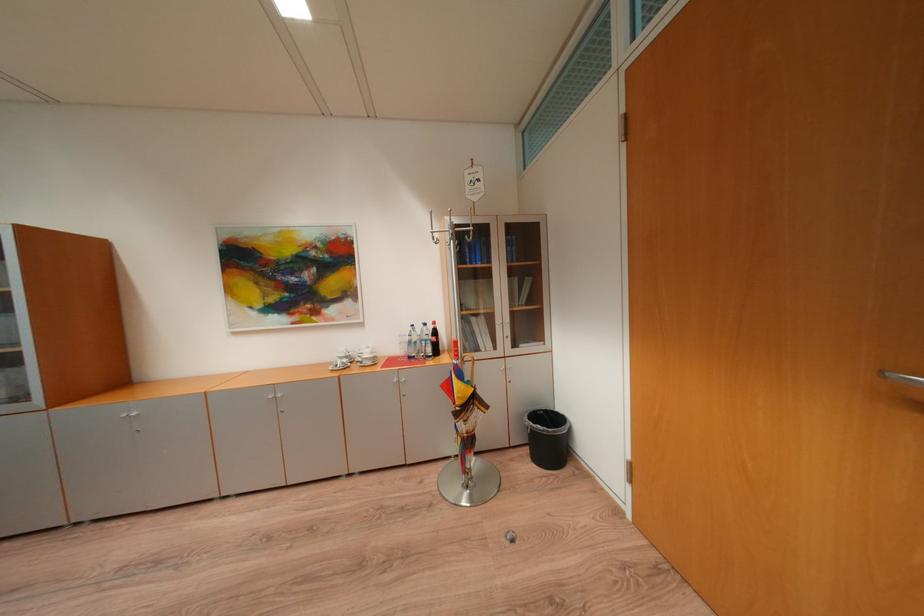
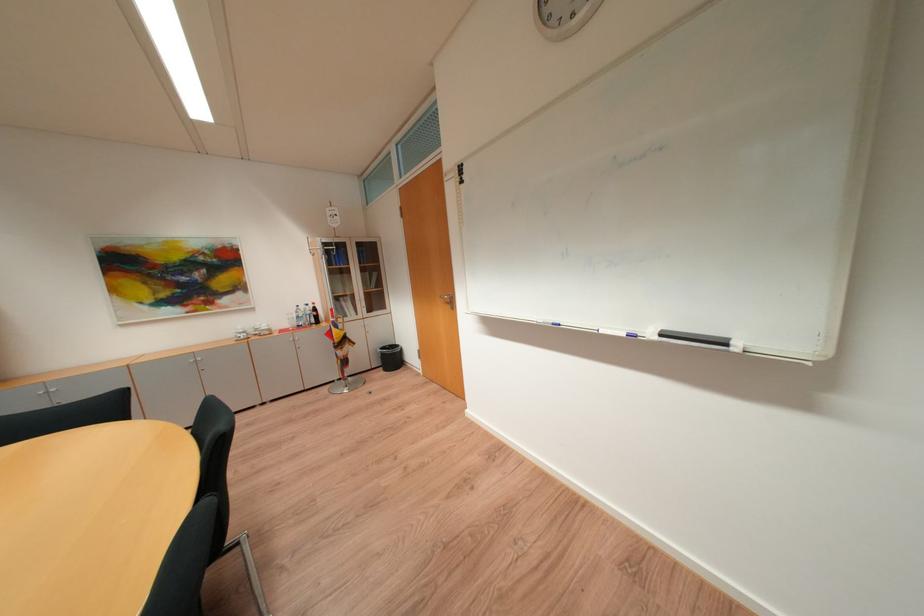
In the second image, find the point that corresponds to the point at 427,329 in the first image.

(310, 309)